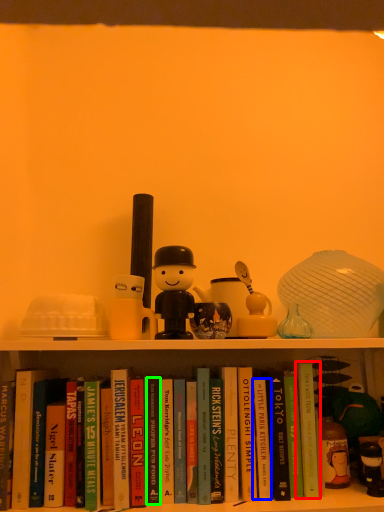
Question: Estimate the real-world distances between objects in this image. Which object is farther from paperback book (highlighted by a red box), paperback book (highlighted by a blue box) or paperback book (highlighted by a green box)?

Choices:
 (A) paperback book
 (B) paperback book

Answer: (B)